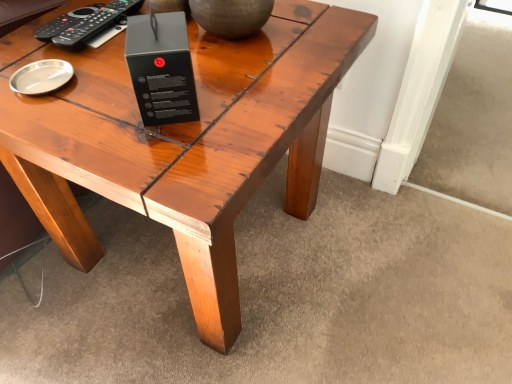
The image size is (512, 384). I want to click on vacant space situated above shiny wood table at center (from a real-world perspective), so click(128, 79).